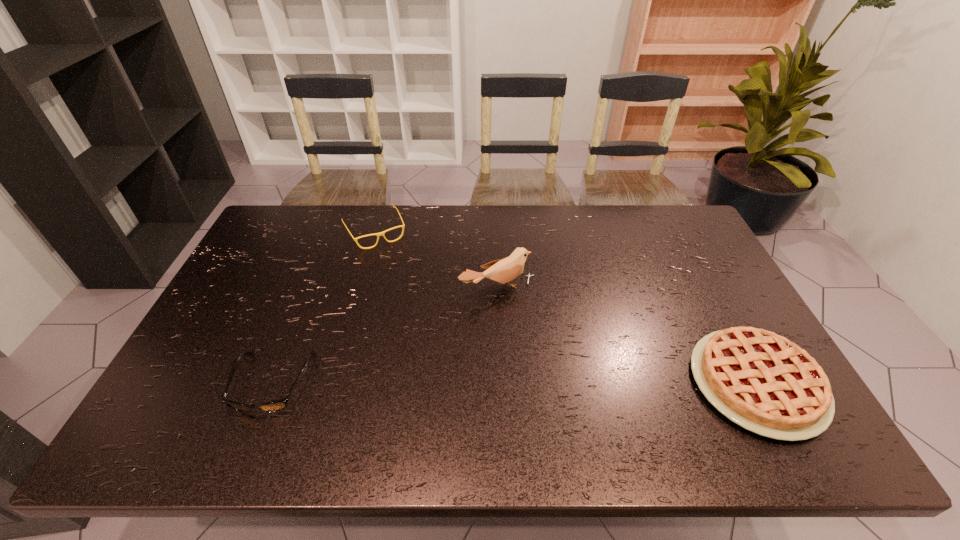
The height and width of the screenshot is (540, 960). Find the location of `the nearer spectacles`. the nearer spectacles is located at coordinates coord(274,406).

The width and height of the screenshot is (960, 540). What are the coordinates of `pie` in the screenshot? It's located at (763, 382).

Locate an element on the screen. The height and width of the screenshot is (540, 960). the second object from right to left is located at coordinates (504, 270).

Image resolution: width=960 pixels, height=540 pixels. What are the coordinates of `the tallest object` in the screenshot? It's located at (504, 270).

Locate an element on the screen. The height and width of the screenshot is (540, 960). the farthest object is located at coordinates (381, 233).

This screenshot has width=960, height=540. Find the location of `vacant space located 0.120m on the left of the rightmost object`. vacant space located 0.120m on the left of the rightmost object is located at coordinates (644, 383).

Where is `vacant space located at the beak of the second farthest object`? This screenshot has height=540, width=960. vacant space located at the beak of the second farthest object is located at coordinates click(574, 381).

I want to click on vacant space located at the beak of the second farthest object, so click(535, 329).

Find the location of a particular element. The image size is (960, 540). vacant space positioned at the beak of the second farthest object is located at coordinates (544, 341).

Locate an element on the screen. vacant space located 0.120m in front of the lenses of the farther spectacles is located at coordinates (396, 271).